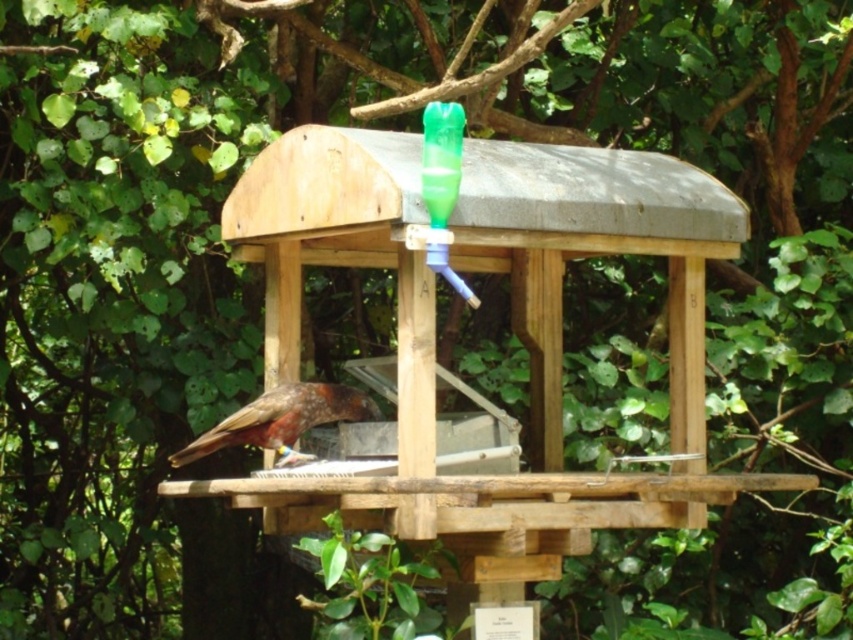
Is brown speckled feathers at center shorter than green translucent bottle at upper center?

Yes.

Who is more forward, (x=357, y=392) or (x=434, y=202)?

Point (x=434, y=202)

Between point (233, 433) and point (432, 145), which one is positioned in front?

Point (432, 145) is more forward.

Image resolution: width=853 pixels, height=640 pixels. Identify the location of brown speckled feathers at center. (282, 420).